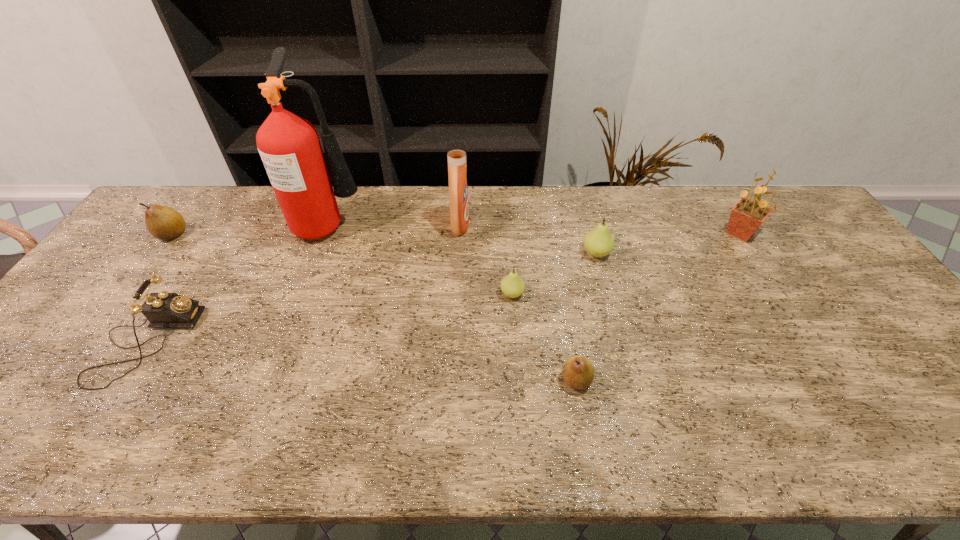
Image resolution: width=960 pixels, height=540 pixels. Find the location of `vacant position located on the left of the farther green pear`. vacant position located on the left of the farther green pear is located at coordinates click(x=452, y=253).

Identify the location of vacant space situated on the front of the bigger brown pear. (144, 273).

Find the location of a particular element. This screenshot has width=960, height=540. vacant area situated on the dial of the telephone is located at coordinates (276, 342).

Identify the location of blank space located on the right of the fifth object from left to right. The height and width of the screenshot is (540, 960). click(561, 294).

Locate an element on the screen. vacant space situated on the back of the second pear from right to left is located at coordinates click(557, 269).

This screenshot has width=960, height=540. What are the coordinates of `fire extinguisher at the far edge` in the screenshot? It's located at (289, 146).

I want to click on detergent at the far edge, so click(x=456, y=152).

Find the location of a particular element. This screenshot has width=960, height=540. sunflower present at the far edge is located at coordinates coord(747,215).

Locate an element on the screen. pear located at the far edge is located at coordinates (164, 223).

Find the location of a particular element. The image size is (960, 540). pear that is positioned at the left edge is located at coordinates (164, 223).